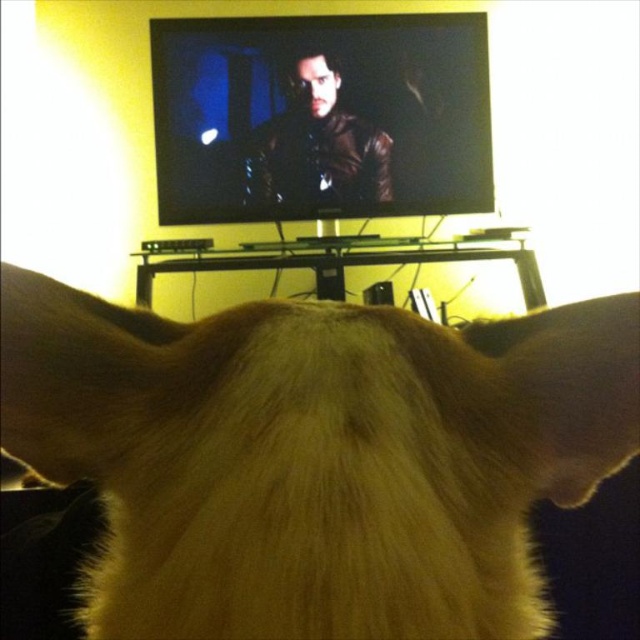
Is brown fur at center above matte black nose at upper center?

No, brown fur at center is not above matte black nose at upper center.

Is point (228, 380) closer to viewer compared to point (320, 93)?

Yes, it is.

The height and width of the screenshot is (640, 640). What do you see at coordinates (316, 456) in the screenshot? I see `brown fur at center` at bounding box center [316, 456].

Where is `brown fur at center`? brown fur at center is located at coordinates (316, 456).

Looking at this image, is brown fur at center bigger than black glass entertainment center at center?

No, brown fur at center is not bigger than black glass entertainment center at center.

Does point (280, 358) come farther from viewer compared to point (536, 268)?

No, (280, 358) is in front of (536, 268).

Describe the element at coordinates (316, 456) in the screenshot. The width and height of the screenshot is (640, 640). I see `brown fur at center` at that location.

You are a GUI agent. You are given a task and a screenshot of the screen. Output one action in this format:
    pyautogui.click(x=<x>, y=<y>)
    Task: Click on the brown fur at center
    
    Given the screenshot: What is the action you would take?
    pyautogui.click(x=316, y=456)

Is matte brown leather jacket at upper center below matte black nose at upper center?

Actually, matte brown leather jacket at upper center is above matte black nose at upper center.

Does matte brown leather jacket at upper center appear on the right side of matte black nose at upper center?

Incorrect, matte brown leather jacket at upper center is not on the right side of matte black nose at upper center.

Does point (317, 90) lie in front of point (326, 74)?

Yes, it is.

Locate an element on the screen. This screenshot has width=640, height=640. matte brown leather jacket at upper center is located at coordinates pyautogui.click(x=310, y=80).